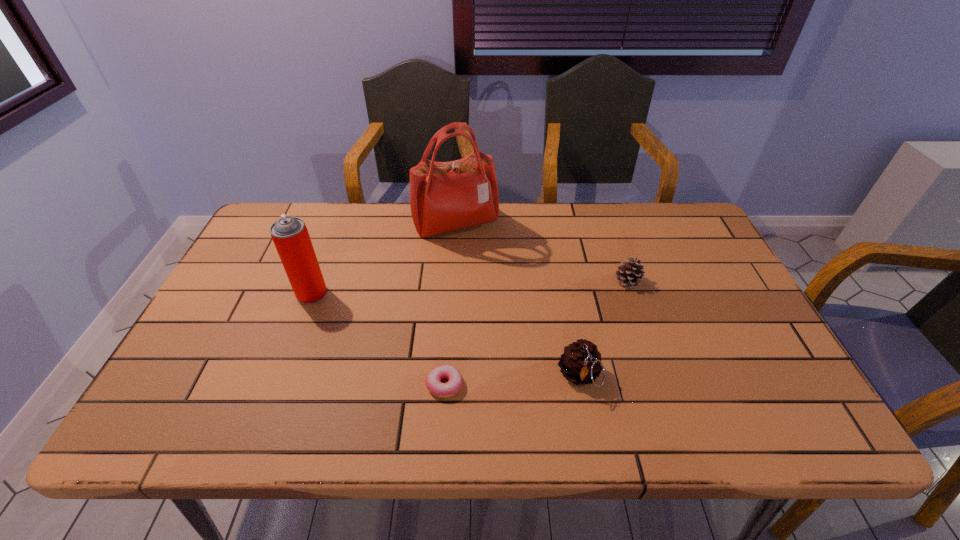
The width and height of the screenshot is (960, 540). In order to click on free space between the leftmost object and the second shortest object in this screenshot , I will do `click(469, 287)`.

The height and width of the screenshot is (540, 960). Identify the location of free spot between the farthest object and the fourth shortest object. (384, 259).

Identify which object is the second nearest to the farther pinecone. Please provide its 2D coordinates. Your answer should be formatted as a tuple, i.e. [(x, y)], where the tuple contains the x and y coordinates of a point satisfying the conditions above.

[(444, 196)]

Select which object appears as the closest to the tallest object. Please provide its 2D coordinates. Your answer should be formatted as a tuple, i.e. [(x, y)], where the tuple contains the x and y coordinates of a point satisfying the conditions above.

[(290, 235)]

I want to click on free location that satisfies the following two spatial constraints: 1. on the front-facing side of the tallest object; 2. on the left side of the second shortest object, so click(x=452, y=282).